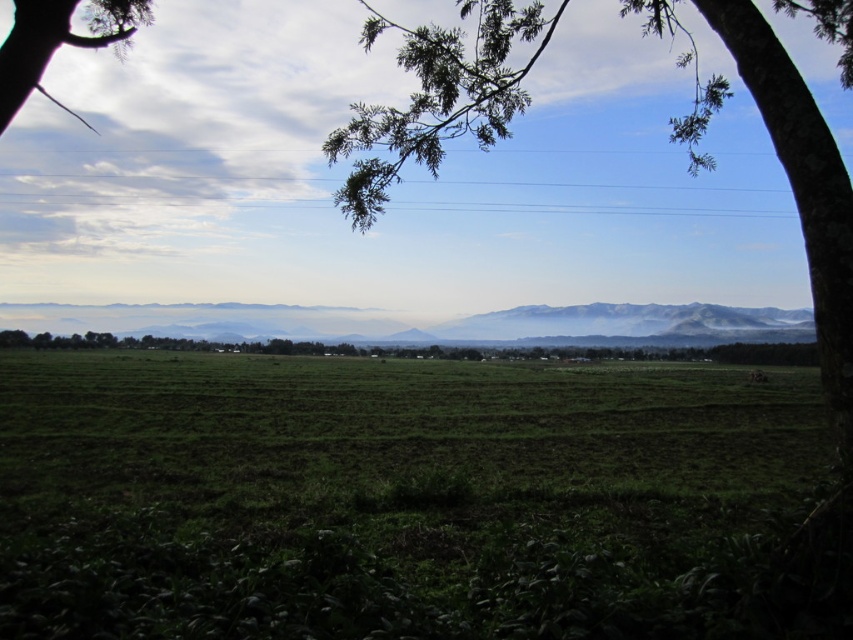
Question: Which object is the closest to the green leafy tree at upper left?

Choices:
 (A) green leafy tree at center
 (B) green matte grass at center

Answer: (B)

Question: Does green matte grass at center appear over green leafy tree at center?

Choices:
 (A) no
 (B) yes

Answer: (A)

Question: Which of these objects is positioned closest to the green leafy tree at center?

Choices:
 (A) green leafy tree at upper left
 (B) green matte grass at center

Answer: (B)

Question: Is green matte grass at center positioned in front of green leafy tree at upper left?

Choices:
 (A) yes
 (B) no

Answer: (A)

Question: Which of these objects is positioned closest to the green matte grass at center?

Choices:
 (A) green leafy tree at center
 (B) green leafy tree at upper left

Answer: (B)

Question: Is green leafy tree at center below green leafy tree at upper left?

Choices:
 (A) yes
 (B) no

Answer: (A)